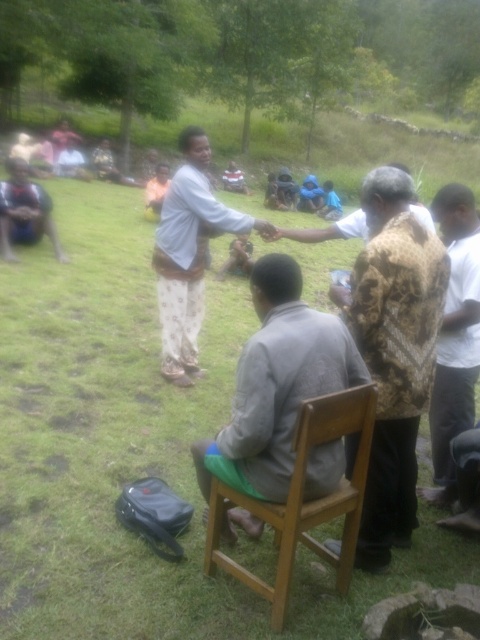
You are organizing a photo shoot and need to place two models wearing the gray fabric shirt at center and the dark blue shirt at lower left. Based on their clothing sizes, which model should wear the smaller outfit?

The gray fabric shirt at center should wear the smaller outfit because its width is less than the dark blue shirt at lower left.

Based on the coordinates provided, which object is located at point (455, 337)?

The point (455, 337) corresponds to the patterned fabric shirt at right.

You are a photographer at the event and want to capture a photo where both the patterned fabric shirt at right and dark blue shirt at lower left are clearly visible. Based on their positions, which shirt should you focus on first to ensure both are in frame?

The patterned fabric shirt at right is positioned under dark blue shirt at lower left, so focusing on the dark blue shirt at lower left first will ensure both are in frame as the patterned fabric shirt at right is below it.